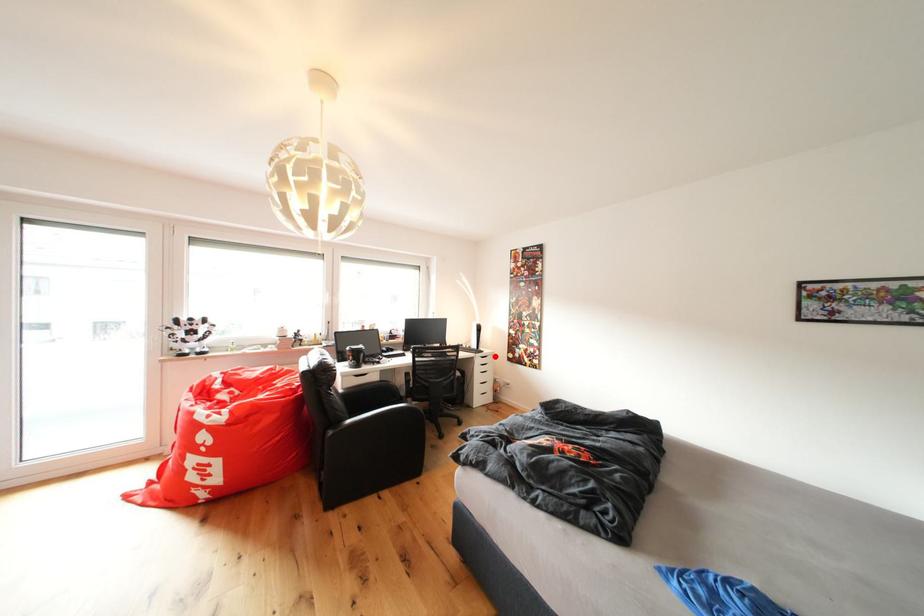
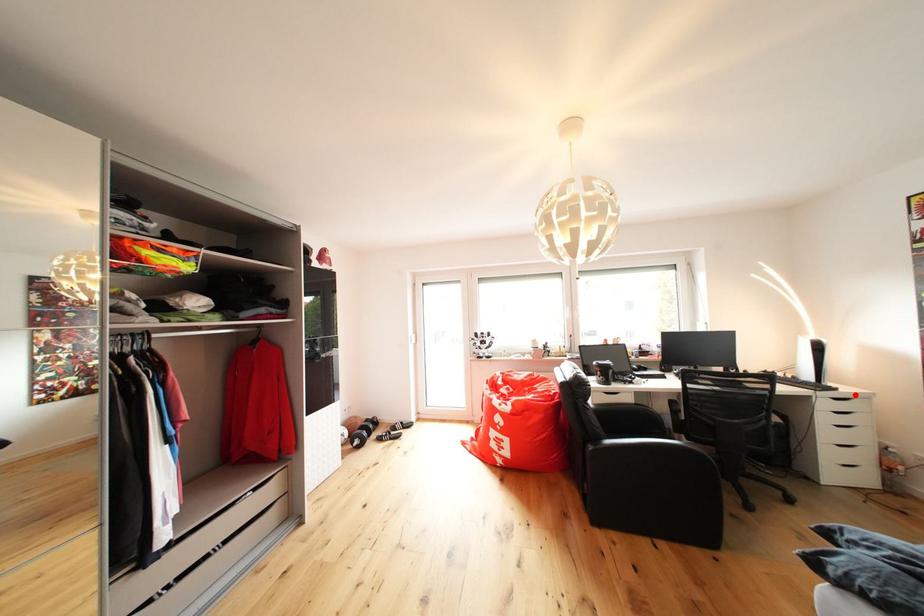
I am providing you with two images of the same scene from different viewpoints. A red point is marked on the first image and another point is marked on the second image. Do the highlighted points in image1 and image2 indicate the same real-world spot?

Yes